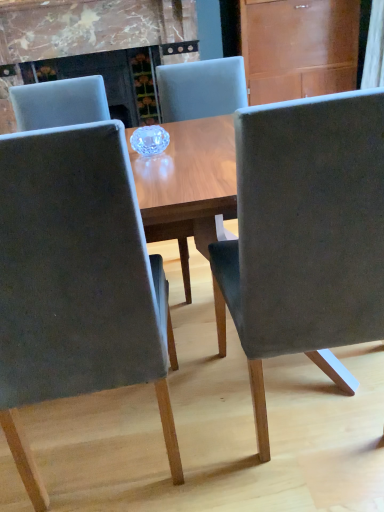
Question: Is wooden at upper right spatially inside suede-like gray chair at center, the second chair when ordered from left to right, or outside of it?

Choices:
 (A) outside
 (B) inside

Answer: (A)

Question: Visually, is wooden at upper right positioned to the left or to the right of suede-like gray chair at center, the second chair when ordered from left to right?

Choices:
 (A) right
 (B) left

Answer: (A)

Question: Which of these objects is positioned closest to the wooden at upper right?

Choices:
 (A) velvet gray chair at center, the first chair from the left
 (B) suede-like gray chair at center, arranged as the 1th chair when viewed from the right
 (C) suede-like gray chair at center, the second chair when ordered from left to right

Answer: (C)

Question: Considering the real-world distances, which object is closest to the suede-like gray chair at center, arranged as the 1th chair when viewed from the right?

Choices:
 (A) wooden at upper right
 (B) velvet gray chair at center, the first chair from the left
 (C) suede-like gray chair at center, placed as the 2th chair when sorted from right to left

Answer: (B)